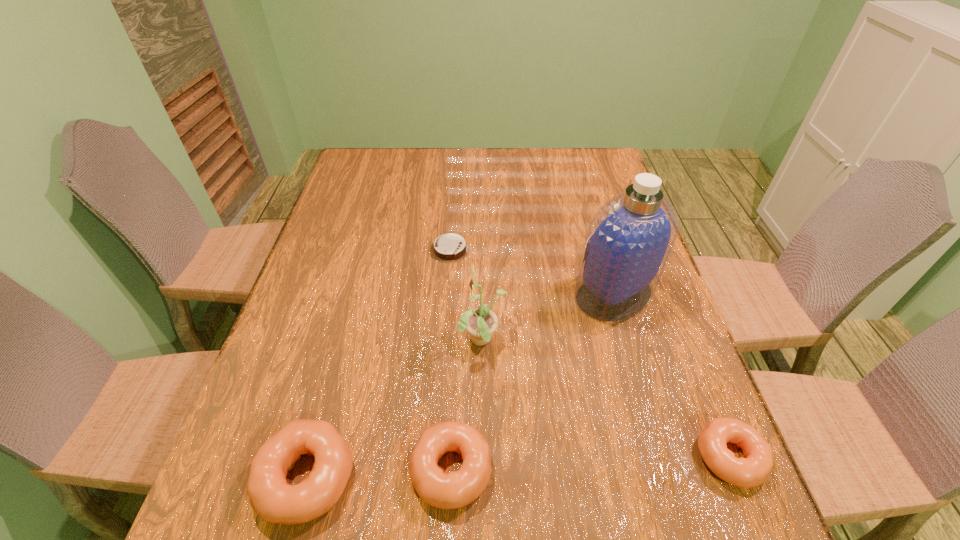
You are a GUI agent. You are given a task and a screenshot of the screen. Output one action in this format:
    pyautogui.click(x=<x>, y=<y>)
    Task: Click on the leftmost doughnut
    
    Given the screenshot: What is the action you would take?
    pyautogui.click(x=271, y=497)

This screenshot has width=960, height=540. What are the coordinates of `the second shortest doughnut` in the screenshot? It's located at (456, 489).

This screenshot has height=540, width=960. Find the location of `the fourth tallest object`. the fourth tallest object is located at coordinates (456, 489).

At what (x,y) coordinates should I click in order to perform the action: click on the shortest doughnut. Please return your answer as a coordinate pair (x, y). This screenshot has height=540, width=960. Looking at the image, I should click on (751, 471).

Where is `the second shortest object`? This screenshot has height=540, width=960. the second shortest object is located at coordinates (751, 471).

Where is `chocolate cake`? This screenshot has height=540, width=960. chocolate cake is located at coordinates (448, 248).

Identify the location of the shortest object. The width and height of the screenshot is (960, 540). (448, 248).

The height and width of the screenshot is (540, 960). I want to click on sunflower, so click(x=481, y=323).

Find the location of `the tallest object`. the tallest object is located at coordinates (629, 240).

Locate an element on the screen. free space located 0.240m on the back of the leftmost object is located at coordinates (346, 333).